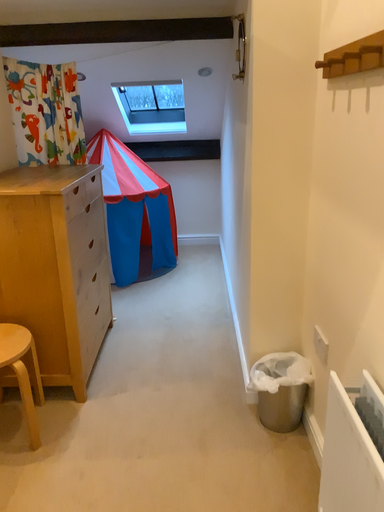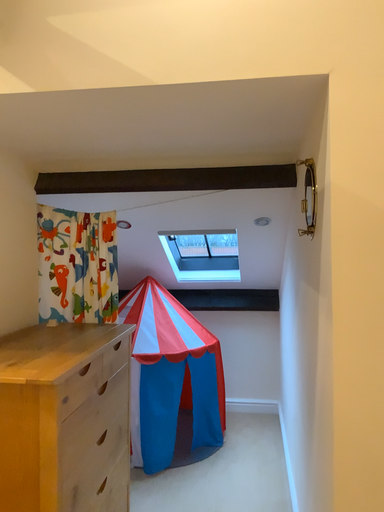
Question: Which way did the camera rotate in the video?

Choices:
 (A) rotated upward
 (B) rotated downward

Answer: (A)